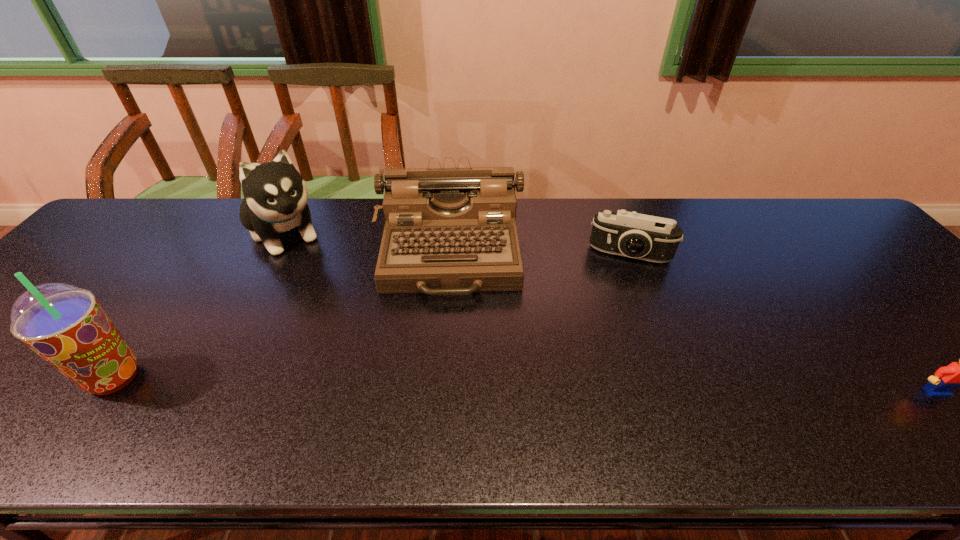
You are a GUI agent. You are given a task and a screenshot of the screen. Output one action in this format:
    pyautogui.click(x=<x>, y=<y>)
    Task: Click on the blank space located 0.130m on the front lens of the fourth object from left to right
    Image resolution: width=960 pixels, height=540 pixels.
    Given the screenshot: What is the action you would take?
    pyautogui.click(x=617, y=299)

At what (x,y) coordinates should I click in order to perform the action: click on vacant space situated on the keyboard of the third object from right to left. Please return your answer as a coordinate pair (x, y). The width and height of the screenshot is (960, 540). Looking at the image, I should click on (445, 387).

Where is `free space located 0.170m on the keyboard of the third object from right to left`? This screenshot has width=960, height=540. free space located 0.170m on the keyboard of the third object from right to left is located at coordinates click(x=446, y=360).

Identify the location of free space located on the keyboard of the third object from right to left. 445,383.

Identify the location of blank space located 0.220m at the face of the second object from left to right. (334, 303).

Where is `vacant region located 0.340m at the face of the second object from left to right`? The image size is (960, 540). vacant region located 0.340m at the face of the second object from left to right is located at coordinates (356, 333).

This screenshot has width=960, height=540. I want to click on vacant space located at the face of the second object from left to right, so click(340, 310).

The height and width of the screenshot is (540, 960). In order to click on camera at the far edge in this screenshot , I will do `click(630, 234)`.

The width and height of the screenshot is (960, 540). Identify the location of typewriter that is at the far edge. (448, 231).

Identify the location of puppy that is at the far edge. The width and height of the screenshot is (960, 540). (275, 194).